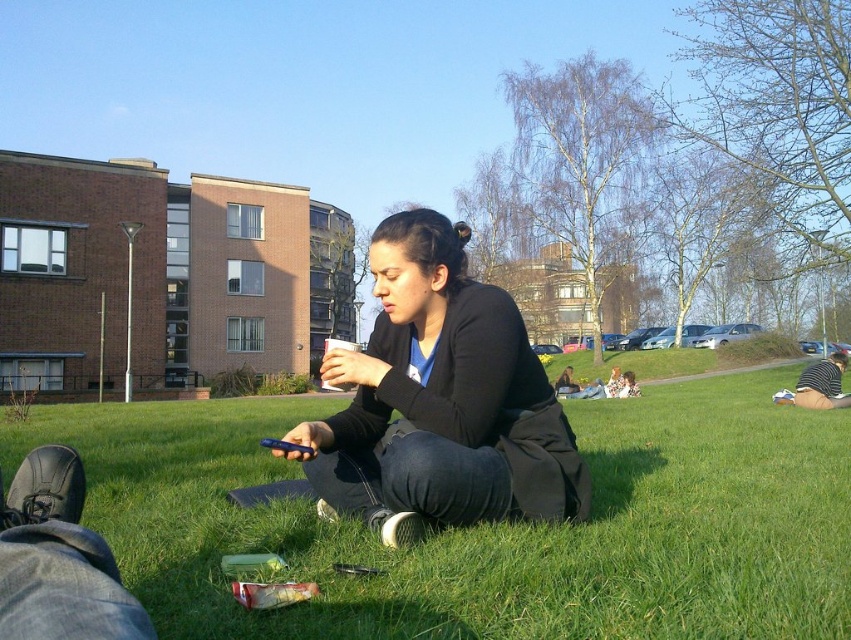
Question: Among these points, which one is farthest from the camera?

Choices:
 (A) click(510, 365)
 (B) click(698, 509)

Answer: (B)

Question: Is green grass at center to the right of black matte jacket at center from the viewer's perspective?

Choices:
 (A) no
 (B) yes

Answer: (B)

Question: Is green grass at center closer to the viewer compared to black matte jacket at center?

Choices:
 (A) no
 (B) yes

Answer: (B)

Question: Is green grass at center positioned before black matte jacket at center?

Choices:
 (A) no
 (B) yes

Answer: (B)

Question: Which of the following is the farthest from the observer?

Choices:
 (A) black matte jacket at center
 (B) green grass at center

Answer: (A)

Question: Which of the following is the closest to the observer?

Choices:
 (A) green grass at center
 (B) black matte jacket at center

Answer: (A)